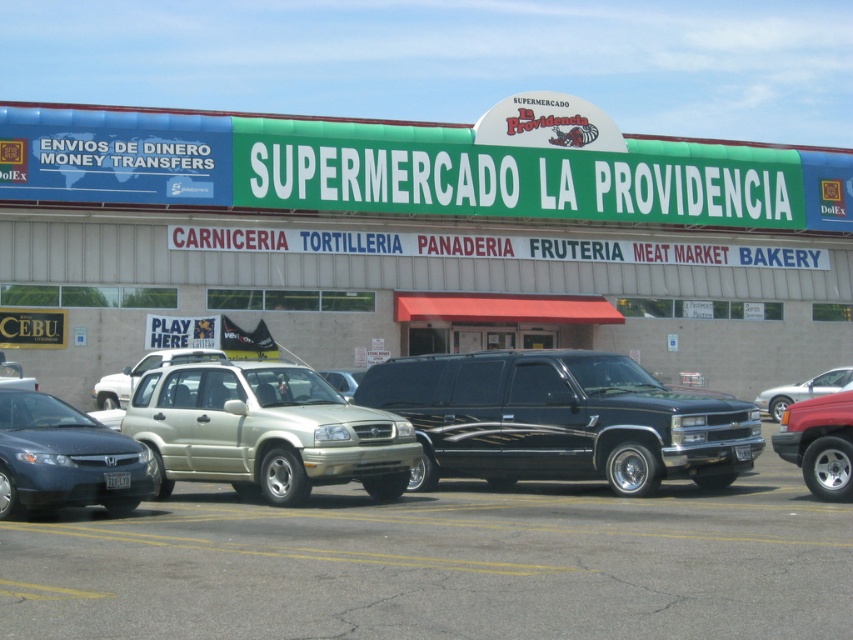
You are a customer arriving at Supermercado La Providencia and want to park your car. You see a matte gray sedan at lower left and a green sign at upper center. Which object is closer to the entrance of the building?

The matte gray sedan at lower left is behind the green sign at upper center, so the green sign at upper center is closer to the entrance of the building.

You are standing in front of the Supermercado La Providencia building and want to locate the green sign at upper center. Based on the coordinates provided, where should you look?

The green sign at upper center is located at coordinates point [419,240].

You are standing in front of the Supermercado La Providencia building and need to take a photo of the green sign at upper center and the gold matte suv at center in the same frame. Based on their distance, will you need to zoom in or out to include both in the photo?

The green sign at upper center and gold matte suv at center are 68.43 feet apart. To include both in the same frame, you would need to zoom out to capture the wider angle required for the distance between them.